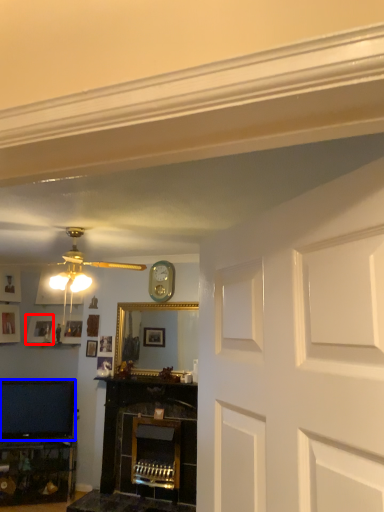
Question: Which of the following is the closest to the observer, picture frame (highlighted by a red box) or television (highlighted by a blue box)?

Choices:
 (A) picture frame
 (B) television

Answer: (B)